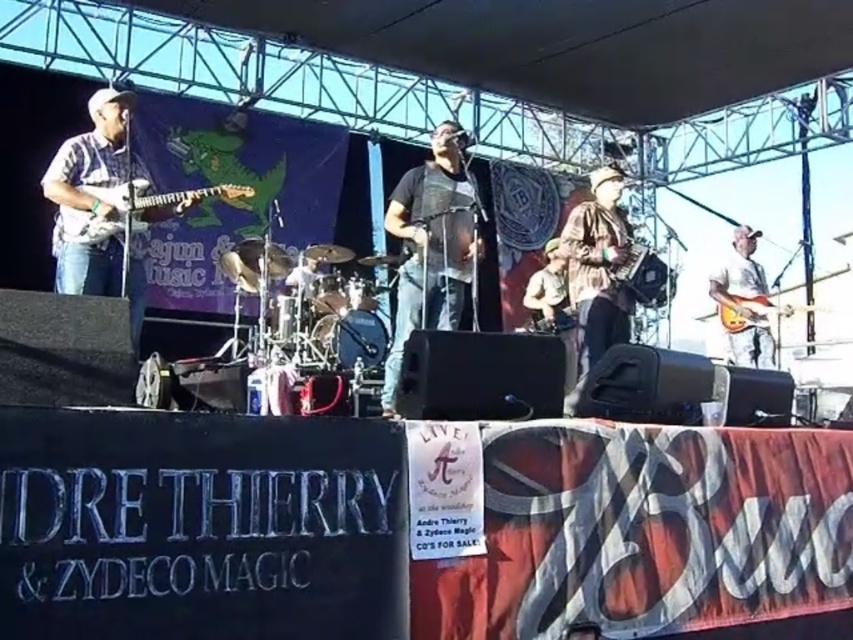
Is camouflage fabric jacket at center bigger than matte black electric guitar at left?

Yes.

Is camouflage fabric jacket at center positioned in front of matte black electric guitar at left?

That is False.

Measure the distance between point (584, 310) and camera.

Point (584, 310) is 5.29 meters away from camera.

In order to click on camouflage fabric jacket at center in this screenshot , I will do `click(596, 266)`.

Between point (584, 326) and point (763, 300), which one is positioned in front?

Positioned in front is point (584, 326).

Does camouflage fabric jacket at center have a larger size compared to light brown wooden guitar at right?

No, camouflage fabric jacket at center is not bigger than light brown wooden guitar at right.

Describe the element at coordinates (596, 266) in the screenshot. This screenshot has width=853, height=640. I see `camouflage fabric jacket at center` at that location.

Identify the location of camouflage fabric jacket at center. This screenshot has width=853, height=640. (596, 266).

Who is higher up, brown leather guitar at center or light brown wooden guitar at right?

brown leather guitar at center is above.

Does brown leather guitar at center come in front of light brown wooden guitar at right?

Yes.

This screenshot has width=853, height=640. I want to click on brown leather guitar at center, so click(548, 291).